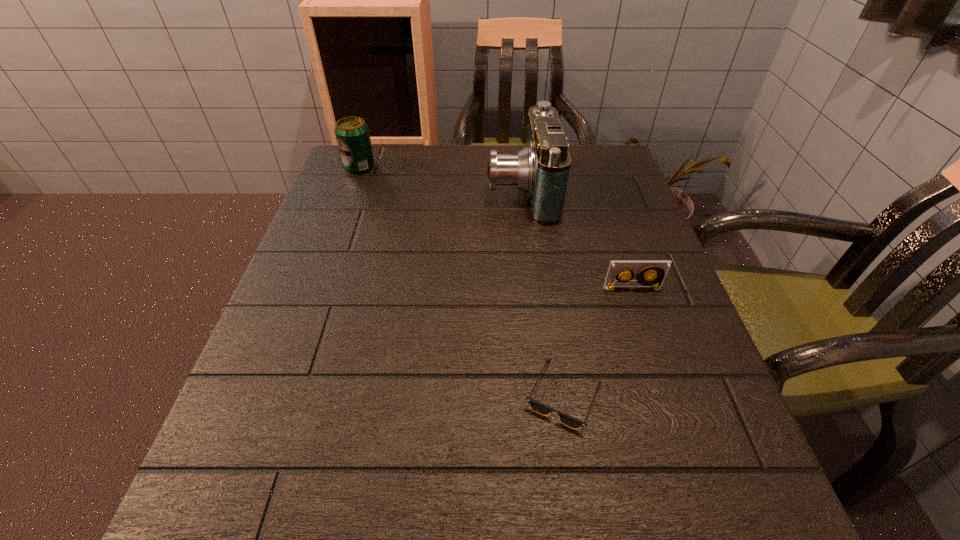
The width and height of the screenshot is (960, 540). Find the location of `free spot located on the right of the leftmost object`. free spot located on the right of the leftmost object is located at coordinates pos(423,167).

I want to click on vacant space situated at the front of the third tallest object with visible reels, so click(x=684, y=441).

At what (x,y) coordinates should I click in order to perform the action: click on free space located 0.070m on the lenses of the nearest object. Please return your answer as a coordinate pair (x, y). Image resolution: width=960 pixels, height=540 pixels. Looking at the image, I should click on (577, 484).

This screenshot has width=960, height=540. I want to click on camcorder that is positioned at the far edge, so click(541, 169).

I want to click on beer can present at the far edge, so click(x=352, y=134).

Where is `object that is at the left edge`? This screenshot has width=960, height=540. object that is at the left edge is located at coordinates (352, 134).

The height and width of the screenshot is (540, 960). I want to click on object that is positioned at the right edge, so pyautogui.click(x=658, y=270).

This screenshot has height=540, width=960. Identify the location of object that is at the far left corner. (352, 134).

Where is `vacant area at the far edge`? vacant area at the far edge is located at coordinates (475, 181).

At what (x,y) coordinates should I click in order to perform the action: click on vacant space at the near edge. Please return your answer as a coordinate pair (x, y). Looking at the image, I should click on (478, 513).